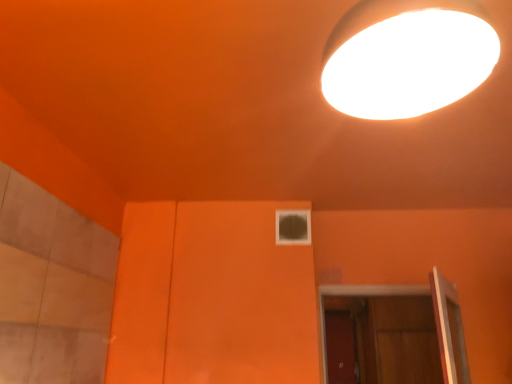
Question: Would you say transparent glass window at center is a long distance from white glossy lamp at upper right?

Choices:
 (A) yes
 (B) no

Answer: (A)

Question: Can you confirm if transparent glass window at center is thinner than white glossy lamp at upper right?

Choices:
 (A) yes
 (B) no

Answer: (A)

Question: Is transparent glass window at center at the right side of white glossy lamp at upper right?

Choices:
 (A) no
 (B) yes

Answer: (A)

Question: Can you confirm if transparent glass window at center is taller than white glossy lamp at upper right?

Choices:
 (A) no
 (B) yes

Answer: (A)

Question: From the image's perspective, does transparent glass window at center appear lower than white glossy lamp at upper right?

Choices:
 (A) no
 (B) yes

Answer: (B)

Question: In the image, is white glossy lamp at upper right on the left side or the right side of wooden at lower right?

Choices:
 (A) right
 (B) left

Answer: (B)

Question: Is white glossy lamp at upper right spatially inside wooden at lower right, or outside of it?

Choices:
 (A) outside
 (B) inside

Answer: (A)

Question: Is point (371, 82) closer or farther from the camera than point (438, 299)?

Choices:
 (A) farther
 (B) closer

Answer: (B)

Question: Is white glossy lamp at upper right in front of or behind wooden at lower right in the image?

Choices:
 (A) front
 (B) behind

Answer: (A)

Question: Is white glossy lamp at upper right spatially inside transparent glass window at center, or outside of it?

Choices:
 (A) outside
 (B) inside

Answer: (A)

Question: Considering their positions, is white glossy lamp at upper right located in front of or behind transparent glass window at center?

Choices:
 (A) front
 (B) behind

Answer: (A)

Question: In terms of width, does white glossy lamp at upper right look wider or thinner when compared to transparent glass window at center?

Choices:
 (A) thin
 (B) wide

Answer: (B)

Question: From a real-world perspective, is white glossy lamp at upper right above or below transparent glass window at center?

Choices:
 (A) below
 (B) above

Answer: (A)

Question: From a real-world perspective, is wooden at lower right physically located above or below transparent glass window at center?

Choices:
 (A) above
 (B) below

Answer: (B)

Question: Is wooden at lower right inside the boundaries of transparent glass window at center, or outside?

Choices:
 (A) outside
 (B) inside

Answer: (A)